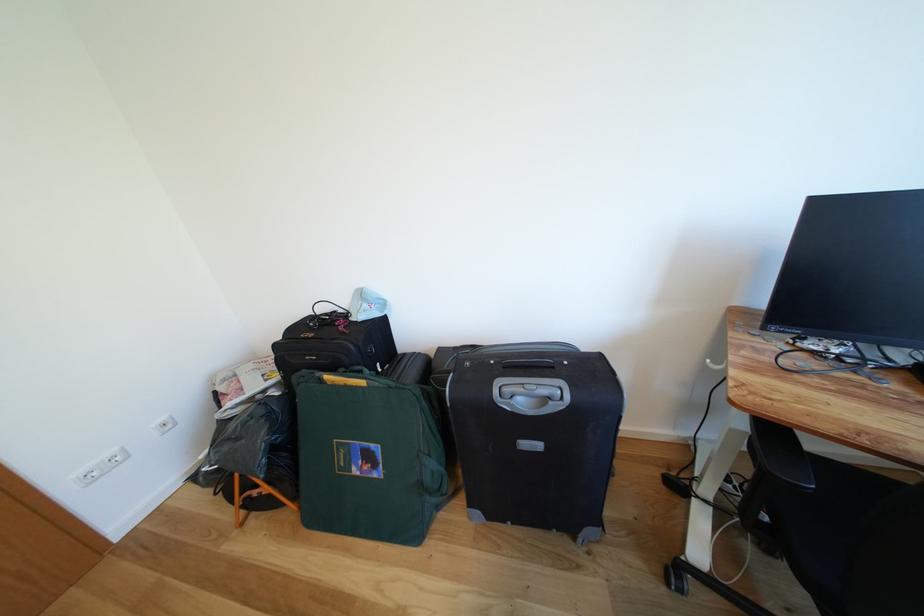
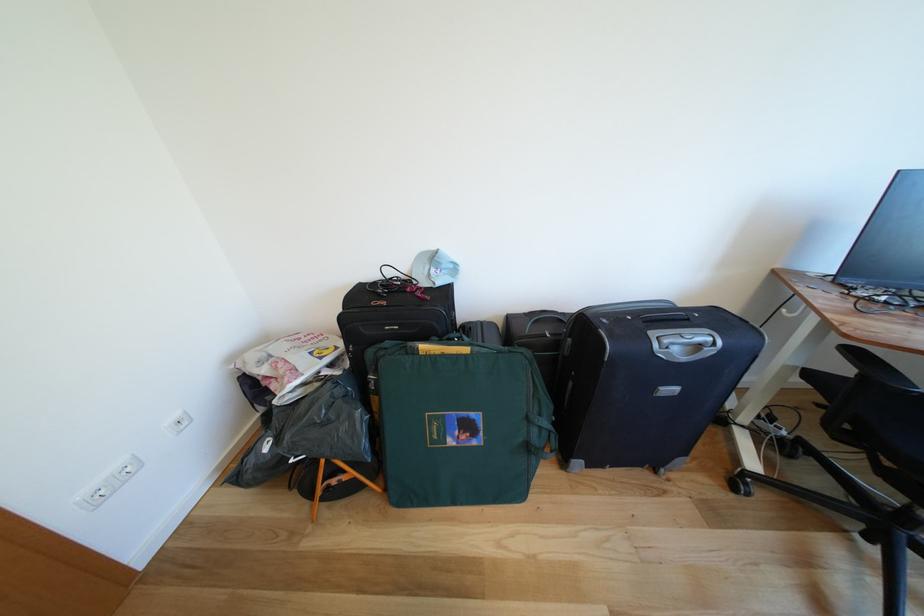
Question: The camera is either moving clockwise (left) or counter-clockwise (right) around the object. The first image is from the beginning of the video and the second image is from the end. Is the camera moving left or right when shooting the video?

Choices:
 (A) Left
 (B) Right

Answer: (A)